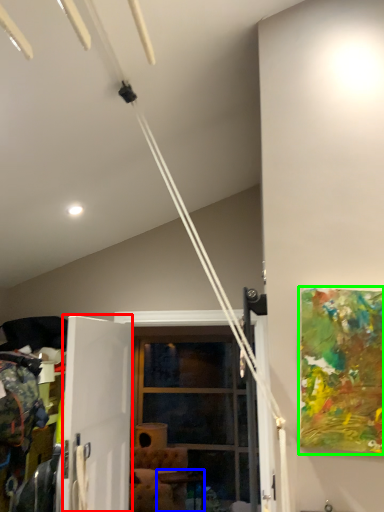
Question: Which object is the farthest from screen door (highlighted by a red box)? Choose among these: table (highlighted by a blue box) or picture frame (highlighted by a green box).

Choices:
 (A) table
 (B) picture frame

Answer: (A)